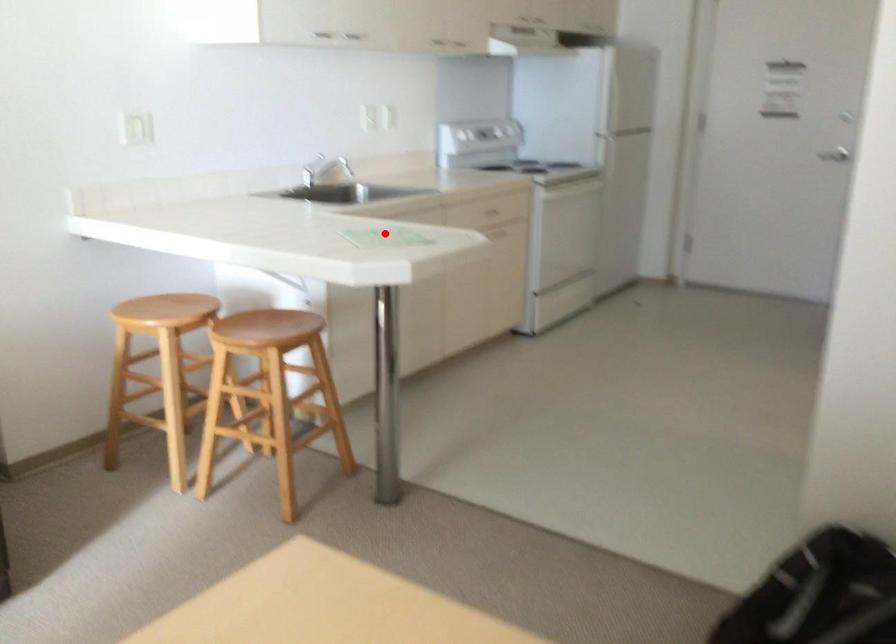
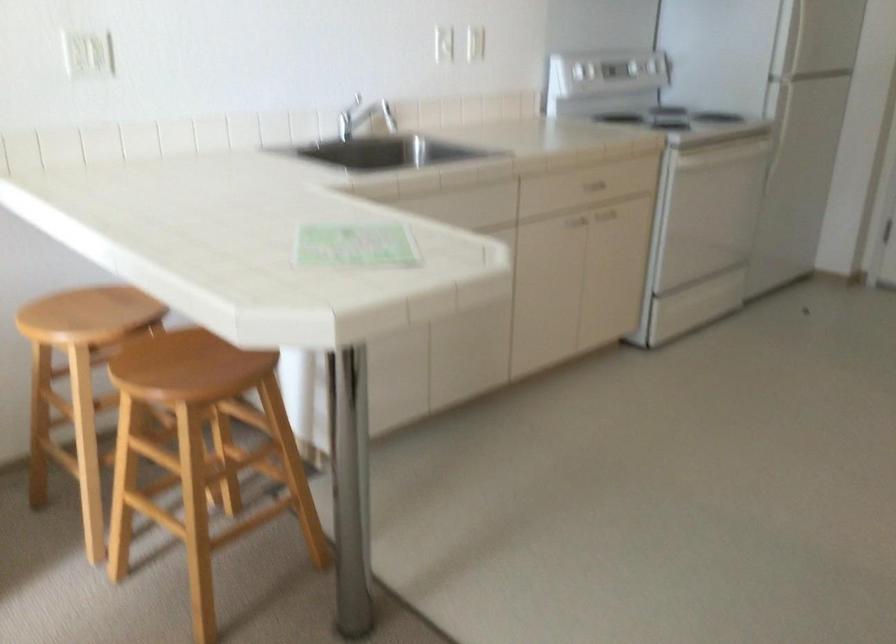
Locate, in the second image, the point that corresponds to the highlighted location in the first image.

(355, 245)